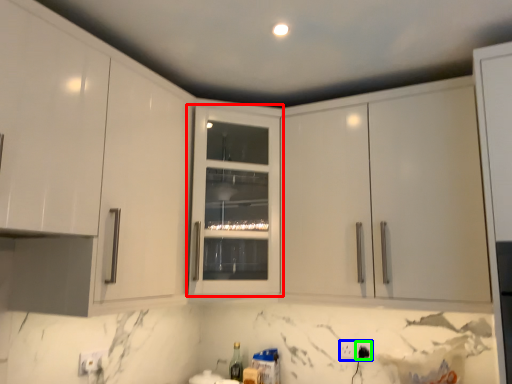
Question: Which object is the farthest from cabinetry (highlighted by a red box)? Choose among these: electric outlet (highlighted by a blue box) or electric outlet (highlighted by a green box).

Choices:
 (A) electric outlet
 (B) electric outlet

Answer: (B)